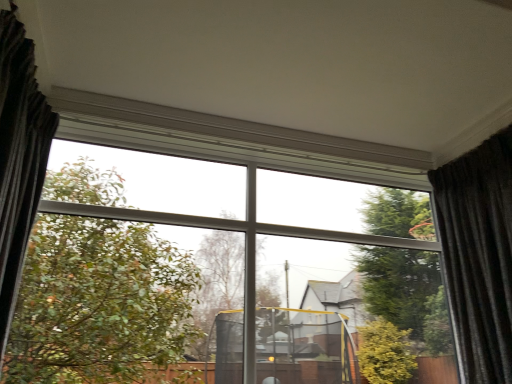
What do you see at coordinates (19, 155) in the screenshot?
I see `dark gray textured curtain at left, the first curtain viewed from the left` at bounding box center [19, 155].

Where is `dark gray textured curtain at left, the first curtain viewed from the left`? dark gray textured curtain at left, the first curtain viewed from the left is located at coordinates (19, 155).

The height and width of the screenshot is (384, 512). Describe the element at coordinates (479, 254) in the screenshot. I see `dark grey textured curtain at right, the 2th curtain viewed from the left` at that location.

Identify the location of dark grey textured curtain at right, placed as the 1th curtain when sorted from right to left. (479, 254).

Where is `dark gray textured curtain at left, arranged as the 2th curtain when viewed from the right`? dark gray textured curtain at left, arranged as the 2th curtain when viewed from the right is located at coordinates (19, 155).

Is dark grey textured curtain at right, placed as the 1th curtain when sorted from right to left, at the left side of dark gray textured curtain at left, the first curtain viewed from the left?

No, dark grey textured curtain at right, placed as the 1th curtain when sorted from right to left, is not to the left of dark gray textured curtain at left, the first curtain viewed from the left.

Considering their positions, is dark grey textured curtain at right, the 2th curtain viewed from the left, located in front of or behind dark gray textured curtain at left, the first curtain viewed from the left?

In the image, dark grey textured curtain at right, the 2th curtain viewed from the left, appears behind dark gray textured curtain at left, the first curtain viewed from the left.

Does point (508, 165) appear closer or farther from the camera than point (22, 137)?

Clearly, point (508, 165) is more distant from the camera than point (22, 137).

From the image's perspective, is dark grey textured curtain at right, the 2th curtain viewed from the left, above or below dark gray textured curtain at left, arranged as the 2th curtain when viewed from the right?

Clearly, from the image's perspective, dark grey textured curtain at right, the 2th curtain viewed from the left, is below dark gray textured curtain at left, arranged as the 2th curtain when viewed from the right.

In the scene shown: From a real-world perspective, who is located lower, dark grey textured curtain at right, the 2th curtain viewed from the left, or dark gray textured curtain at left, arranged as the 2th curtain when viewed from the right?

dark grey textured curtain at right, the 2th curtain viewed from the left, from a real-world perspective.

Based on the photo, which object is thinner, dark grey textured curtain at right, placed as the 1th curtain when sorted from right to left, or dark gray textured curtain at left, arranged as the 2th curtain when viewed from the right?

dark gray textured curtain at left, arranged as the 2th curtain when viewed from the right, is thinner.

Can you confirm if dark grey textured curtain at right, placed as the 1th curtain when sorted from right to left, is shorter than dark gray textured curtain at left, arranged as the 2th curtain when viewed from the right?

Incorrect, the height of dark grey textured curtain at right, placed as the 1th curtain when sorted from right to left, does not fall short of that of dark gray textured curtain at left, arranged as the 2th curtain when viewed from the right.

Between dark grey textured curtain at right, the 2th curtain viewed from the left, and dark gray textured curtain at left, arranged as the 2th curtain when viewed from the right, which one has larger size?

dark grey textured curtain at right, the 2th curtain viewed from the left.

Is dark gray textured curtain at left, arranged as the 2th curtain when viewed from the right, a part of dark grey textured curtain at right, placed as the 1th curtain when sorted from right to left?

That's incorrect, dark gray textured curtain at left, arranged as the 2th curtain when viewed from the right, is not inside dark grey textured curtain at right, placed as the 1th curtain when sorted from right to left.

Are dark grey textured curtain at right, placed as the 1th curtain when sorted from right to left, and dark gray textured curtain at left, arranged as the 2th curtain when viewed from the right, far apart?

Absolutely, dark grey textured curtain at right, placed as the 1th curtain when sorted from right to left, is distant from dark gray textured curtain at left, arranged as the 2th curtain when viewed from the right.

Could you tell me if dark grey textured curtain at right, placed as the 1th curtain when sorted from right to left, is turned towards dark gray textured curtain at left, arranged as the 2th curtain when viewed from the right?

Yes, dark grey textured curtain at right, placed as the 1th curtain when sorted from right to left, is oriented towards dark gray textured curtain at left, arranged as the 2th curtain when viewed from the right.

You are a GUI agent. You are given a task and a screenshot of the screen. Output one action in this format:
    pyautogui.click(x=<x>, y=<y>)
    Task: Click on the curtain in front of the dark grey textured curtain at right, the 2th curtain viewed from the left
    The image size is (512, 384).
    Given the screenshot: What is the action you would take?
    pyautogui.click(x=19, y=155)

Which object is positioned more to the right, dark gray textured curtain at left, arranged as the 2th curtain when viewed from the right, or dark grey textured curtain at right, placed as the 1th curtain when sorted from right to left?

Positioned to the right is dark grey textured curtain at right, placed as the 1th curtain when sorted from right to left.

Considering the positions of objects dark gray textured curtain at left, the first curtain viewed from the left, and dark grey textured curtain at right, placed as the 1th curtain when sorted from right to left, in the image provided, who is behind, dark gray textured curtain at left, the first curtain viewed from the left, or dark grey textured curtain at right, placed as the 1th curtain when sorted from right to left,?

dark grey textured curtain at right, placed as the 1th curtain when sorted from right to left.

Which is closer, (3, 349) or (485, 195)?

Clearly, point (3, 349) is closer to the camera than point (485, 195).

From the image's perspective, is dark gray textured curtain at left, the first curtain viewed from the left, located above or below dark grey textured curtain at right, placed as the 1th curtain when sorted from right to left?

dark gray textured curtain at left, the first curtain viewed from the left, is situated higher than dark grey textured curtain at right, placed as the 1th curtain when sorted from right to left, in the image.

From a real-world perspective, between dark gray textured curtain at left, the first curtain viewed from the left, and dark grey textured curtain at right, the 2th curtain viewed from the left, who is vertically lower?

dark grey textured curtain at right, the 2th curtain viewed from the left, from a real-world perspective.

Considering the relative sizes of dark gray textured curtain at left, arranged as the 2th curtain when viewed from the right, and dark grey textured curtain at right, placed as the 1th curtain when sorted from right to left, in the image provided, is dark gray textured curtain at left, arranged as the 2th curtain when viewed from the right, wider than dark grey textured curtain at right, placed as the 1th curtain when sorted from right to left,?

No, dark gray textured curtain at left, arranged as the 2th curtain when viewed from the right, is not wider than dark grey textured curtain at right, placed as the 1th curtain when sorted from right to left.

Who is shorter, dark gray textured curtain at left, arranged as the 2th curtain when viewed from the right, or dark grey textured curtain at right, the 2th curtain viewed from the left?

With less height is dark gray textured curtain at left, arranged as the 2th curtain when viewed from the right.

In the scene shown: Considering the sizes of dark gray textured curtain at left, the first curtain viewed from the left, and dark grey textured curtain at right, placed as the 1th curtain when sorted from right to left, in the image, is dark gray textured curtain at left, the first curtain viewed from the left, bigger or smaller than dark grey textured curtain at right, placed as the 1th curtain when sorted from right to left,?

Clearly, dark gray textured curtain at left, the first curtain viewed from the left, is smaller in size than dark grey textured curtain at right, placed as the 1th curtain when sorted from right to left.

Would you say dark gray textured curtain at left, the first curtain viewed from the left, is inside or outside dark grey textured curtain at right, placed as the 1th curtain when sorted from right to left?

dark gray textured curtain at left, the first curtain viewed from the left, is not inside dark grey textured curtain at right, placed as the 1th curtain when sorted from right to left, it's outside.

Are dark gray textured curtain at left, arranged as the 2th curtain when viewed from the right, and dark grey textured curtain at right, the 2th curtain viewed from the left, located far from each other?

Indeed, dark gray textured curtain at left, arranged as the 2th curtain when viewed from the right, is not near dark grey textured curtain at right, the 2th curtain viewed from the left.

Is dark gray textured curtain at left, the first curtain viewed from the left, facing away from dark grey textured curtain at right, placed as the 1th curtain when sorted from right to left?

No, dark gray textured curtain at left, the first curtain viewed from the left,'s orientation is not away from dark grey textured curtain at right, placed as the 1th curtain when sorted from right to left.

Can you tell me how much dark gray textured curtain at left, arranged as the 2th curtain when viewed from the right, and dark grey textured curtain at right, the 2th curtain viewed from the left, differ in facing direction?

179 degrees.

Locate an element on the screen. The image size is (512, 384). curtain in front of the dark grey textured curtain at right, placed as the 1th curtain when sorted from right to left is located at coordinates (19, 155).

Find the location of a particular element. curtain below the dark gray textured curtain at left, the first curtain viewed from the left (from a real-world perspective) is located at coordinates (479, 254).

I want to click on curtain above the dark grey textured curtain at right, placed as the 1th curtain when sorted from right to left (from a real-world perspective), so click(19, 155).